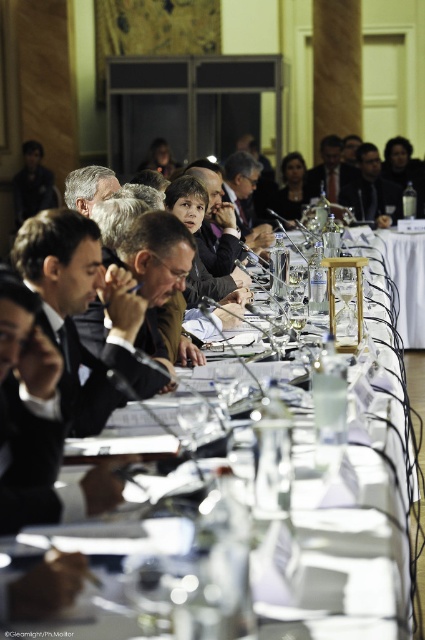
Is white paper at center further to the viewer compared to gray hair at upper left?

That is False.

Can you confirm if white paper at center is taller than gray hair at upper left?

No.

The height and width of the screenshot is (640, 425). What are the coordinates of `white paper at center` in the screenshot? It's located at (354, 560).

Identify the location of white paper at center. Image resolution: width=425 pixels, height=640 pixels. (354, 560).

Is white paper at center positioned behind matte black jacket at upper center?

No.

Who is more forward, (374, 592) or (376, 147)?

Positioned in front is point (374, 592).

Where is `white paper at center`? The width and height of the screenshot is (425, 640). white paper at center is located at coordinates (354, 560).

Looking at this image, is matte black jacket at upper center shorter than gray hair at upper left?

Incorrect, matte black jacket at upper center's height does not fall short of gray hair at upper left's.

Measure the distance between matte black jacket at upper center and gray hair at upper left.

matte black jacket at upper center and gray hair at upper left are 28.34 feet apart.

The image size is (425, 640). What do you see at coordinates (371, 189) in the screenshot?
I see `matte black jacket at upper center` at bounding box center [371, 189].

This screenshot has width=425, height=640. I want to click on matte black jacket at upper center, so click(371, 189).